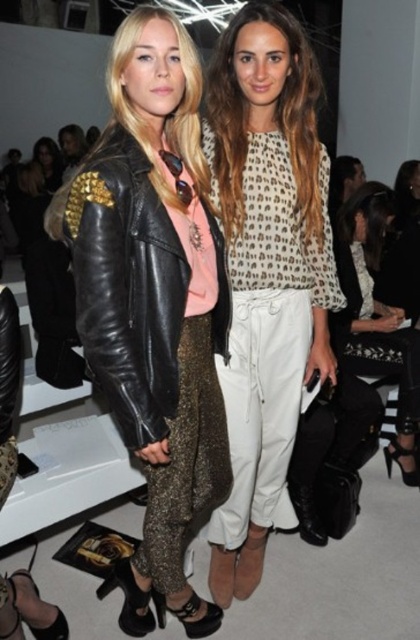
Question: Which object is the closest to the white textured pants at center?

Choices:
 (A) shiny black leather jacket at center
 (B) printed fabric blouse at center

Answer: (B)

Question: Based on their relative distances, which object is farther from the shiny black leather jacket at center?

Choices:
 (A) white textured pants at center
 (B) printed fabric blouse at center

Answer: (A)

Question: Can you confirm if printed fabric blouse at center is positioned below white textured pants at center?

Choices:
 (A) yes
 (B) no

Answer: (B)

Question: Among these objects, which one is farthest from the camera?

Choices:
 (A) white textured pants at center
 (B) shiny black leather jacket at center
 (C) printed fabric blouse at center

Answer: (A)

Question: Can you confirm if shiny black leather jacket at center is positioned to the right of printed fabric blouse at center?

Choices:
 (A) yes
 (B) no

Answer: (B)

Question: Is shiny black leather jacket at center below white textured pants at center?

Choices:
 (A) no
 (B) yes

Answer: (B)